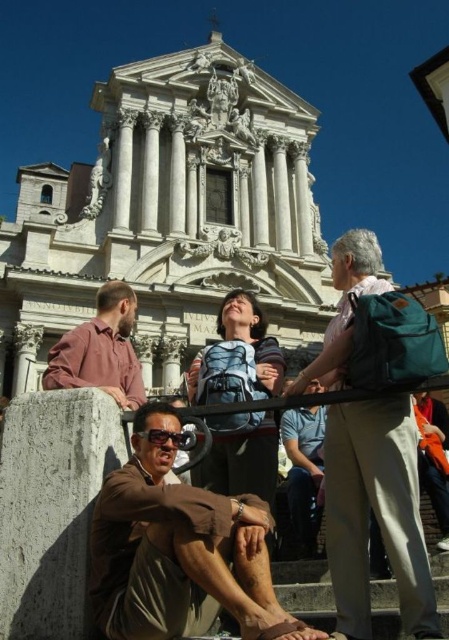
You are a photographer standing at the center of the scene. You need to capture a photo that includes the brown cotton shirt at lower center. Based on its position, where should you aim your camera to ensure it is in the frame?

The brown cotton shirt at lower center is located at point 0.863 on the horizontal axis and 0.399 on the vertical axis. To include it in the frame, aim your camera towards the lower center area, slightly to the right since the horizontal coordinate is 0.863, which indicates a position closer to the right edge of the scene.

In the scene shown: You are standing at the point with coordinates point (242,461). What object is located at this position?

The point (242,461) corresponds to the blue backpack at center.